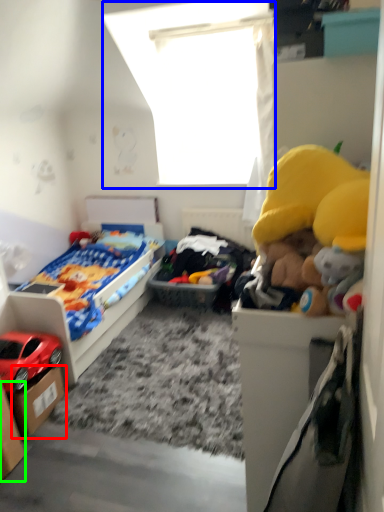
Question: Which object is the farthest from storage box (highlighted by a red box)? Choose among these: window screen (highlighted by a blue box) or storage box (highlighted by a green box).

Choices:
 (A) window screen
 (B) storage box

Answer: (A)